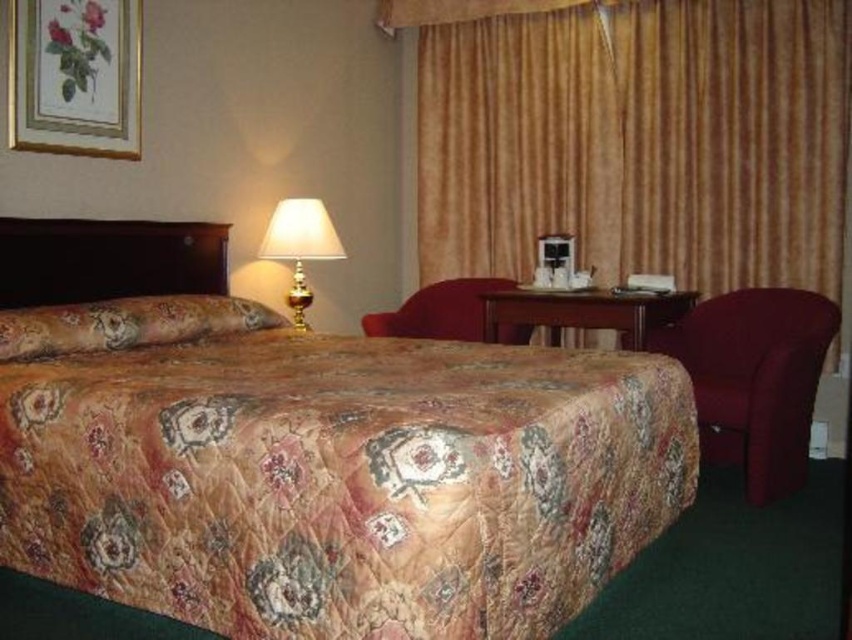
Who is shorter, velvet burgundy armchair at right or gold metallic table lamp at upper center?

gold metallic table lamp at upper center is shorter.

Is point (830, 316) less distant than point (281, 259)?

That is True.

Between point (694, 372) and point (269, 259), which one is positioned behind?

The point (269, 259) is behind.

Identify the location of velvet burgundy armchair at right. The height and width of the screenshot is (640, 852). (x=753, y=378).

Can you confirm if velvet gold curtain at upper right is shorter than velvet burgundy armchair at right?

No, velvet gold curtain at upper right is not shorter than velvet burgundy armchair at right.

What do you see at coordinates (634, 136) in the screenshot? I see `velvet gold curtain at upper right` at bounding box center [634, 136].

Is point (459, 100) positioned before point (802, 433)?

That is False.

The height and width of the screenshot is (640, 852). In order to click on velvet gold curtain at upper right in this screenshot , I will do `click(634, 136)`.

Can you confirm if velvet red armchair at center is positioned below gold metallic table lamp at upper center?

Correct, velvet red armchair at center is located below gold metallic table lamp at upper center.

Which of these two, velvet red armchair at center or gold metallic table lamp at upper center, stands shorter?

Standing shorter between the two is velvet red armchair at center.

Which is behind, point (465, 307) or point (291, 228)?

The point (465, 307) is more distant.

This screenshot has height=640, width=852. I want to click on velvet red armchair at center, so click(x=438, y=310).